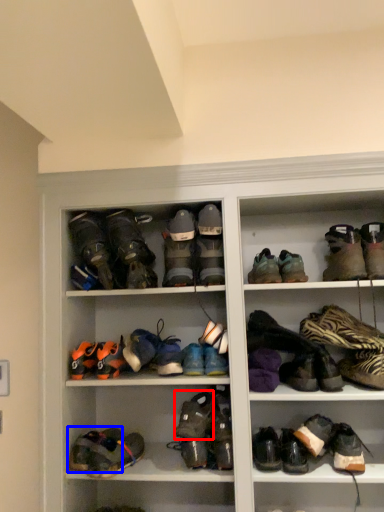
Question: Among these objects, which one is nearest to the camera, footwear (highlighted by a red box) or footwear (highlighted by a blue box)?

Choices:
 (A) footwear
 (B) footwear

Answer: (A)